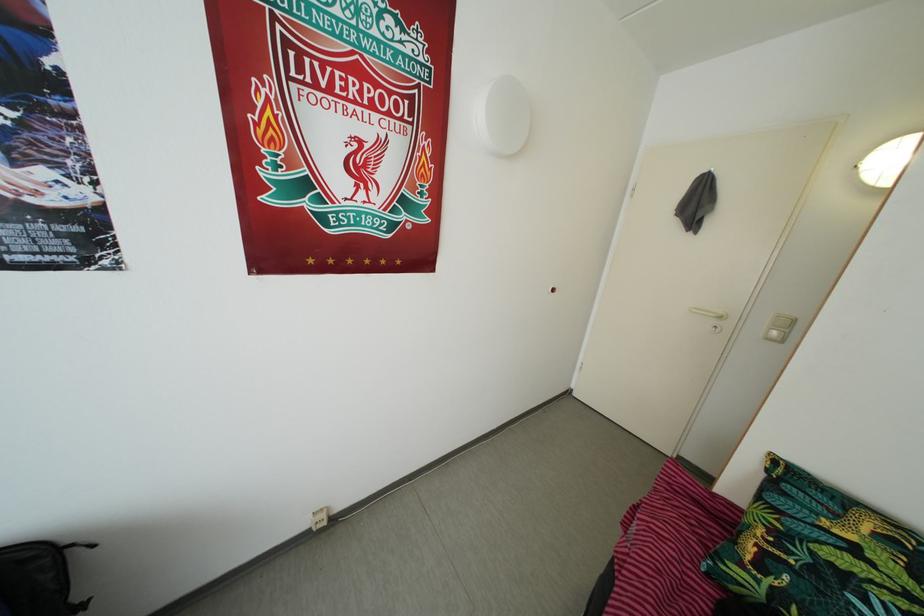
What do you see at coordinates (708, 312) in the screenshot?
I see `a white door handle` at bounding box center [708, 312].